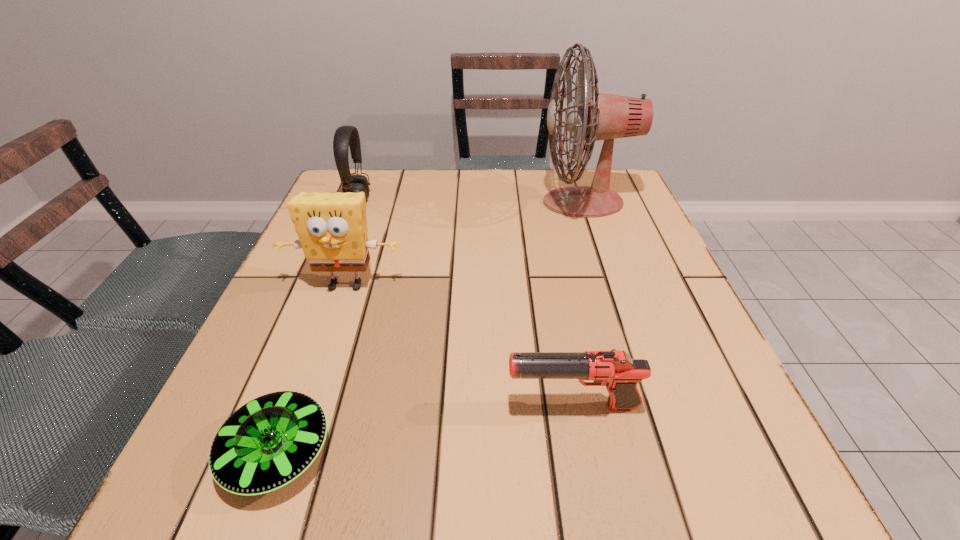
In the image, there is a desktop. What are the coordinates of `blank space at the near left corner` in the screenshot? It's located at (166, 502).

Where is `free region at the near right corner`? free region at the near right corner is located at coordinates (741, 480).

Find the location of a particular element. The image size is (960, 540). free spot between the saucer and the headset is located at coordinates (318, 326).

You are a GUI agent. You are given a task and a screenshot of the screen. Output one action in this format:
    pyautogui.click(x=<x>, y=<y>)
    Task: Click on the blank region between the headset and the gun
    
    Given the screenshot: What is the action you would take?
    pyautogui.click(x=466, y=303)

Find the location of a particular element. The height and width of the screenshot is (540, 960). free area in between the saucer and the second shortest object is located at coordinates (425, 429).

The height and width of the screenshot is (540, 960). What are the coordinates of `vacant area between the fourth tallest object and the tallest object` in the screenshot? It's located at (578, 304).

Identify the location of vacant space that's between the fan and the second shortest object. The height and width of the screenshot is (540, 960). (578, 304).

Identify the location of free space between the saucer and the second shortest object. (425, 429).

Where is `free spot between the saucer and the headset`? free spot between the saucer and the headset is located at coordinates (318, 326).

Find the location of `free area in between the third nearest object and the second shortest object`. free area in between the third nearest object and the second shortest object is located at coordinates (460, 346).